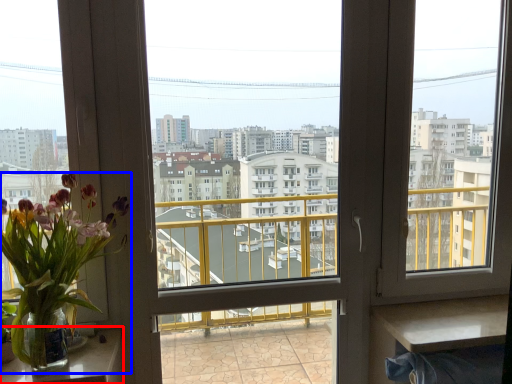
Question: Which of the following is the closest to the observer, table (highlighted by a red box) or houseplant (highlighted by a blue box)?

Choices:
 (A) table
 (B) houseplant

Answer: (B)